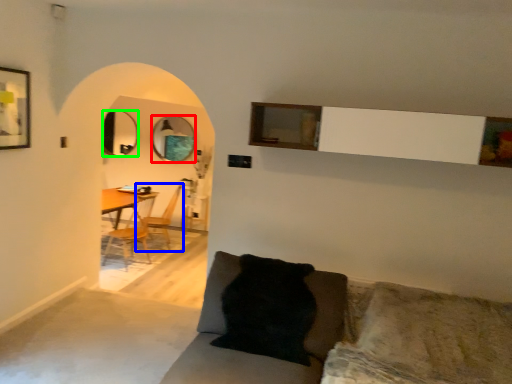
Question: Considering the real-world distances, which object is farthest from mirror (highlighted by a red box)? armchair (highlighted by a blue box) or mirror (highlighted by a green box)?

Choices:
 (A) armchair
 (B) mirror

Answer: (A)